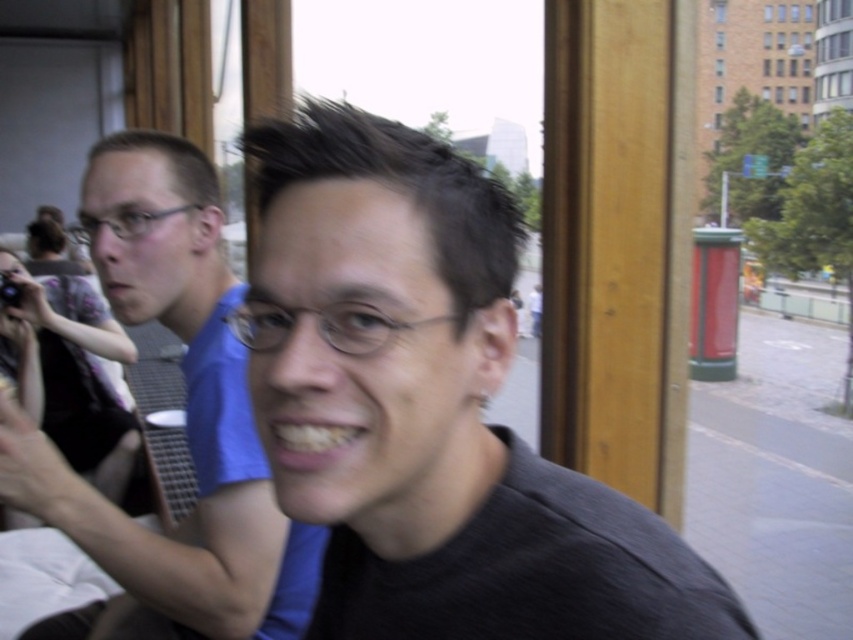
Based on the photo, you are standing in front of the scene and want to touch the point at coordinates point (743,634). Can you reach it without moving your feet?

The point (743,634) is 21.50 inches from the viewer. Since the average human arm length is about 25 inches, you can reach it without moving your feet.

You are a photographer trying to capture a detailed shot of the blue fabric shirt at left and the matte black camera at left. Given their sizes in the frame, which object would you need to move closer to the camera to ensure both are equally visible?

The blue fabric shirt at left occupies less space than the matte black camera at left, so you would need to move the blue fabric shirt at left closer to the camera to make them appear the same size in the photo.

You are standing in the urban scene shown. You notice two points marked in the image. The first point is at coordinates point (126, 605) and the second is at point (49, 365). Which point is closer to you?

Point (126, 605) is in front of point (49, 365), so it is closer to you.